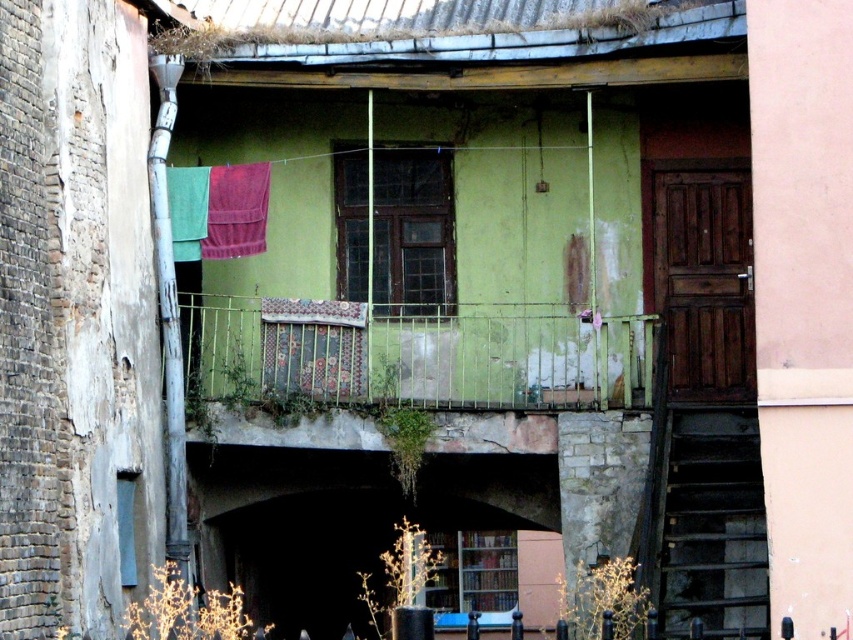
Question: Which of the following is the farthest from the observer?

Choices:
 (A) click(x=341, y=388)
 (B) click(x=233, y=205)
 (C) click(x=296, y=364)

Answer: (C)

Question: Which point appears farthest from the camera in this image?

Choices:
 (A) (286, 380)
 (B) (241, 248)
 (C) (335, 392)

Answer: (B)

Question: Is floral fabric curtain at center to the left of velvet pink curtain at upper left from the viewer's perspective?

Choices:
 (A) yes
 (B) no

Answer: (B)

Question: Can you confirm if green metal railing at center is positioned above velvet pink curtain at upper left?

Choices:
 (A) no
 (B) yes

Answer: (A)

Question: Is floral fabric curtain at center above velvet pink curtain at upper left?

Choices:
 (A) yes
 (B) no

Answer: (B)

Question: Which object is positioned farthest from the green metal railing at center?

Choices:
 (A) velvet pink curtain at upper left
 (B) floral fabric curtain at center

Answer: (A)